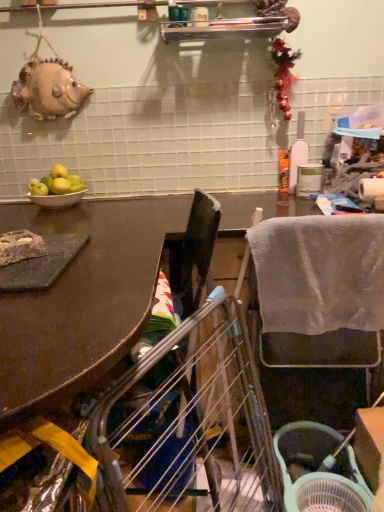
The width and height of the screenshot is (384, 512). What do you see at coordinates (57, 199) in the screenshot? I see `white ceramic bowl at left` at bounding box center [57, 199].

Describe the element at coordinates (82, 298) in the screenshot. This screenshot has height=512, width=384. I see `brown matte table at upper left` at that location.

Measure the distance between point (137, 245) and camera.

The distance of point (137, 245) from camera is 1.16 meters.

Locate an element on the screen. The image size is (384, 512). white ceramic bowl at left is located at coordinates (57, 199).

Which object is closer to the camera, brown matte table at upper left or gray fabric chair at right?

Positioned in front is brown matte table at upper left.

Considering the sizes of objects brown matte table at upper left and gray fabric chair at right in the image provided, who is smaller, brown matte table at upper left or gray fabric chair at right?

gray fabric chair at right.

Considering the sizes of objects brown matte table at upper left and gray fabric chair at right in the image provided, who is taller, brown matte table at upper left or gray fabric chair at right?

brown matte table at upper left.

Does brown matte table at upper left have a lesser width compared to gray fabric chair at right?

Incorrect, the width of brown matte table at upper left is not less than that of gray fabric chair at right.

From the image's perspective, which is above, brown matte table at upper left or white ceramic bowl at left?

white ceramic bowl at left is shown above in the image.

Looking at this image, is brown matte table at upper left far away from white ceramic bowl at left?

No, brown matte table at upper left is in close proximity to white ceramic bowl at left.

Can you tell me how much brown matte table at upper left and white ceramic bowl at left differ in facing direction?

90 degrees separate the facing orientations of brown matte table at upper left and white ceramic bowl at left.

Between brown matte table at upper left and white ceramic bowl at left, which one has smaller width?

Thinner between the two is white ceramic bowl at left.

Looking at this image, is white ceramic bowl at left aimed at metallic silver shelf at upper center?

No, white ceramic bowl at left is not oriented towards metallic silver shelf at upper center.

Considering the positions of objects white ceramic bowl at left and metallic silver shelf at upper center in the image provided, who is more to the left, white ceramic bowl at left or metallic silver shelf at upper center?

Positioned to the left is white ceramic bowl at left.

Is white ceramic bowl at left positioned in front of metallic silver shelf at upper center?

No, it is not.

Does white ceramic bowl at left have a smaller size compared to metallic silver shelf at upper center?

Yes.

Considering the points (322, 262) and (309, 440), which point is behind, point (322, 262) or point (309, 440)?

The point (309, 440) is farther from the camera.

Considering the sizes of gray fabric chair at right and green plastic basket at lower right in the image, is gray fabric chair at right wider or thinner than green plastic basket at lower right?

Clearly, gray fabric chair at right has less width compared to green plastic basket at lower right.

From the image's perspective, is gray fabric chair at right above or below green plastic basket at lower right?

gray fabric chair at right is above green plastic basket at lower right.

In the scene shown: Considering the relative positions of gray fabric chair at right and green plastic basket at lower right in the image provided, is gray fabric chair at right to the left of green plastic basket at lower right from the viewer's perspective?

No, gray fabric chair at right is not to the left of green plastic basket at lower right.

Considering the sizes of objects matte gray stone at left and white ceramic bowl at left in the image provided, who is bigger, matte gray stone at left or white ceramic bowl at left?

white ceramic bowl at left is bigger.

From the picture: How different are the orientations of matte gray stone at left and white ceramic bowl at left in degrees?

The angular difference between matte gray stone at left and white ceramic bowl at left is 41.9 degrees.

The width and height of the screenshot is (384, 512). I want to click on food that is above the white ceramic bowl at left (from a real-world perspective), so click(x=20, y=246).

Is matte gray stone at left positioned with its back to white ceramic bowl at left?

matte gray stone at left is not turned away from white ceramic bowl at left.

Is point (47, 206) closer or farther from the camera than point (354, 230)?

Point (47, 206).

Does white ceramic bowl at left have a smaller size compared to gray fabric chair at right?

Correct, white ceramic bowl at left occupies less space than gray fabric chair at right.

Is white ceramic bowl at left at the right side of gray fabric chair at right?

Incorrect, white ceramic bowl at left is not on the right side of gray fabric chair at right.

Is green plastic basket at lower right completely or partially inside brown matte table at upper left?

That's incorrect, green plastic basket at lower right is not inside brown matte table at upper left.

From the picture: Can you confirm if brown matte table at upper left is thinner than green plastic basket at lower right?

No.

Between brown matte table at upper left and green plastic basket at lower right, which one has more height?

With more height is brown matte table at upper left.

Where is `chair above the brown matte table at upper left (from the image's perspective)`? The height and width of the screenshot is (512, 384). chair above the brown matte table at upper left (from the image's perspective) is located at coordinates (316, 312).

Image resolution: width=384 pixels, height=512 pixels. Identify the location of table on the right of white ceramic bowl at left. (82, 298).

Looking at the image, which one is located closer to green matte apples at left, brown matte table at upper left or white ceramic bowl at left?

Among the two, white ceramic bowl at left is located nearer to green matte apples at left.

When comparing their distances from gray fabric chair at right, does white ceramic bowl at left or metallic silver shelf at upper center seem closer?

white ceramic bowl at left.

When comparing their distances from matte gray stone at left, does gray fabric chair at right or brown matte table at upper left seem closer?

brown matte table at upper left is positioned closer to the anchor matte gray stone at left.

Estimate the real-world distances between objects in this image. Which object is further from gray fabric chair at right, white ceramic bowl at left or green matte apples at left?

white ceramic bowl at left is positioned further to the anchor gray fabric chair at right.

Based on their spatial positions, is brown matte table at upper left or metallic silver shelf at upper center further from green plastic basket at lower right?

Based on the image, metallic silver shelf at upper center appears to be further to green plastic basket at lower right.

Which object lies further to the anchor point white ceramic bowl at left, brown matte table at upper left or gray fabric chair at right?

gray fabric chair at right is positioned further to the anchor white ceramic bowl at left.

Which object lies nearer to the anchor point brown matte table at upper left, green plastic basket at lower right or gray fabric chair at right?

The object closer to brown matte table at upper left is gray fabric chair at right.

From the image, which object appears to be farther from brown matte table at upper left, green matte apples at left or metallic silver shelf at upper center?

metallic silver shelf at upper center.

Where is `fruit between metallic silver shelf at upper center and green plastic basket at lower right vertically`? Image resolution: width=384 pixels, height=512 pixels. fruit between metallic silver shelf at upper center and green plastic basket at lower right vertically is located at coordinates (56, 183).

At what (x,y) coordinates should I click in order to perform the action: click on fruit between metallic silver shelf at upper center and matte gray stone at left in the up-down direction. Please return your answer as a coordinate pair (x, y). Looking at the image, I should click on pyautogui.click(x=56, y=183).

The width and height of the screenshot is (384, 512). In order to click on food between metallic silver shelf at upper center and gray fabric chair at right in the vertical direction in this screenshot , I will do `click(20, 246)`.

Locate an element on the screen. This screenshot has height=512, width=384. fruit that lies between metallic silver shelf at upper center and brown matte table at upper left from top to bottom is located at coordinates (56, 183).